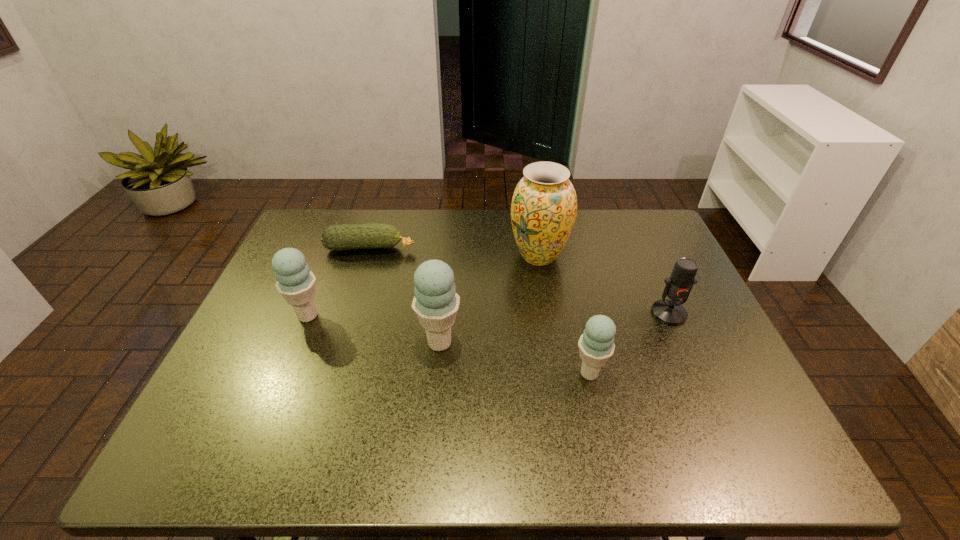
You are a GUI agent. You are given a task and a screenshot of the screen. Output one action in this format:
    pyautogui.click(x=<x>, y=<y>)
    Task: Click on the vacant space located on the right of the vase
    The image size is (960, 540).
    Given the screenshot: What is the action you would take?
    click(x=588, y=256)

Image resolution: width=960 pixels, height=540 pixels. Find the location of `blank space located at the blossom end of the cucumber`. blank space located at the blossom end of the cucumber is located at coordinates (439, 248).

Image resolution: width=960 pixels, height=540 pixels. Identify the location of free location located 0.180m on the side of the microphone with the red ring. [x=702, y=386].

Find the location of a particular element. The height and width of the screenshot is (540, 960). vase that is at the far edge is located at coordinates (544, 206).

The width and height of the screenshot is (960, 540). Identify the location of cucumber that is at the far edge. pos(351,236).

Where is `object at the near edge`? object at the near edge is located at coordinates (596, 345).

The width and height of the screenshot is (960, 540). I want to click on ice cream located in the left edge section of the desktop, so click(296, 283).

This screenshot has width=960, height=540. In order to click on cucumber at the left edge in this screenshot , I will do `click(351, 236)`.

Find the location of `object at the right edge`. object at the right edge is located at coordinates (678, 286).

What are the coordinates of `object located in the far left corner section of the desktop` in the screenshot? It's located at (351, 236).